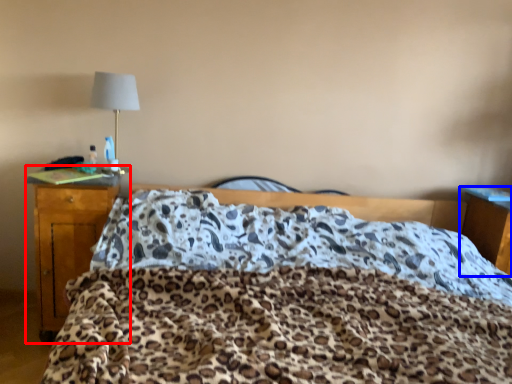
Question: Which of the following is the closest to the observer, desk (highlighted by a red box) or nightstand (highlighted by a blue box)?

Choices:
 (A) desk
 (B) nightstand

Answer: (A)